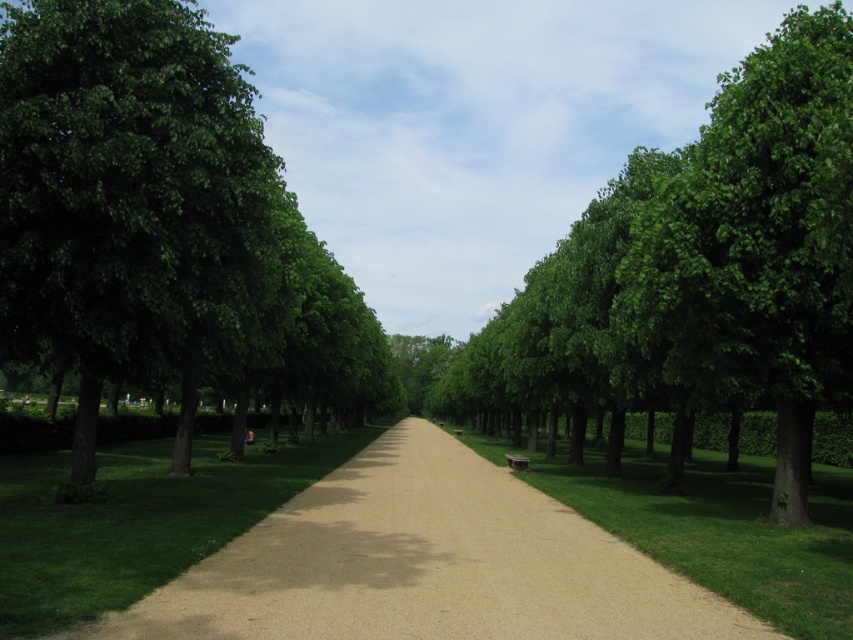
You are a gardener who needs to mow the lawn. You observe the green grass at left and the green grass at center in the park. Which area requires more time to mow based on their sizes?

The green grass at center requires more time to mow because it has a larger size compared to the green grass at left.

You are a gardener who needs to mow the green grass at left and the green grass at center. Which area should you mow first if you want to start from the farthest point from your current position?

The green grass at left is positioned on the left side of green grass at center, so you should mow the green grass at center first because it is farther from your current position.